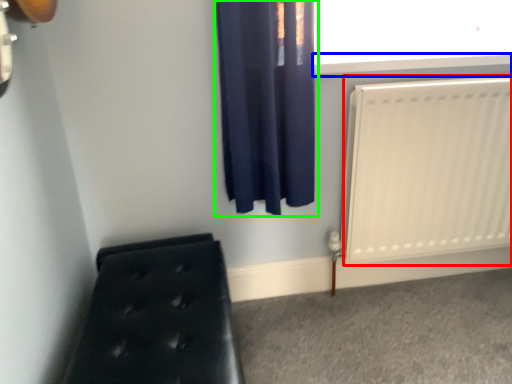
Question: Considering the real-world distances, which object is closest to radiator (highlighted by a red box)? window sill (highlighted by a blue box) or curtain (highlighted by a green box).

Choices:
 (A) window sill
 (B) curtain

Answer: (A)